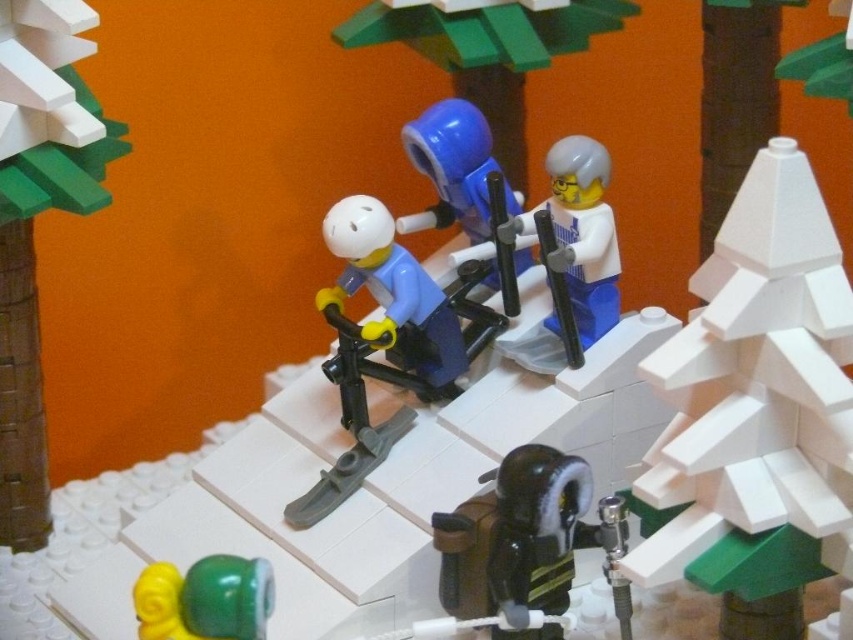
Question: In this image, where is white matte tree at upper right located relative to blue rubber helmet at center?

Choices:
 (A) right
 (B) left

Answer: (A)

Question: Considering the relative positions of white matte figure at center and shiny plastic beads at lower left in the image provided, where is white matte figure at center located with respect to shiny plastic beads at lower left?

Choices:
 (A) below
 (B) above

Answer: (B)

Question: Based on their relative distances, which object is farther from the smooth brown tree trunk at left?

Choices:
 (A) black plastic backpack at center
 (B) shiny plastic beads at lower left
 (C) matte blue skier at center
 (D) blue plastic skis at center

Answer: (A)

Question: Which point is closer to the camera taking this photo?

Choices:
 (A) (20, 212)
 (B) (413, 269)
 (C) (828, 244)
 (D) (577, 465)

Answer: (C)

Question: Which of the following is the closest to the observer?

Choices:
 (A) white matte figure at center
 (B) blue rubber helmet at center
 (C) matte blue skier at center
 (D) shiny plastic beads at lower left

Answer: (D)

Question: Can you confirm if black plastic backpack at center is positioned above white matte figure at center?

Choices:
 (A) yes
 (B) no

Answer: (B)